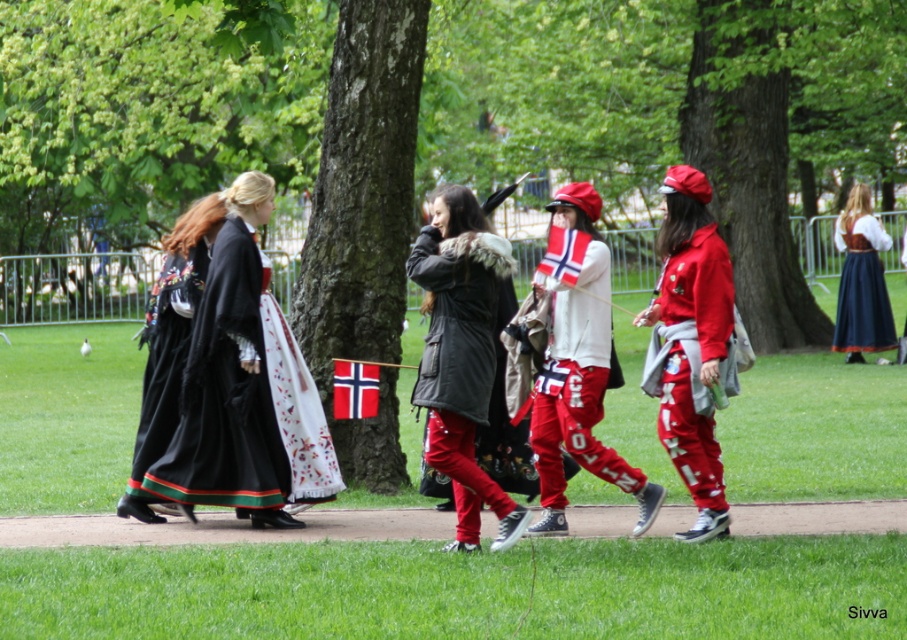
Is matte white hoodie at center wider than white fabric flag at center?

Indeed, matte white hoodie at center has a greater width compared to white fabric flag at center.

Is point (572, 445) less distant than point (551, 225)?

Yes, point (572, 445) is closer to viewer.

The width and height of the screenshot is (907, 640). In order to click on matte white hoodie at center in this screenshot , I will do `click(576, 381)`.

Can you confirm if velvet black dress at left is thinner than red fabric flag at center?

No.

Does velvet black dress at left come behind red fabric flag at center?

That is False.

The image size is (907, 640). What are the coordinates of `velvet black dress at left` in the screenshot? It's located at (169, 346).

What are the coordinates of `velvet black dress at left` in the screenshot? It's located at (169, 346).

At what (x,y) coordinates should I click in order to perform the action: click on matte red tracksuit at center. Please return your answer as a coordinate pair (x, y). Looking at the image, I should click on (698, 292).

Which is behind, point (675, 387) or point (357, 381)?

Positioned behind is point (357, 381).

Who is more distant from viewer, (715, 486) or (367, 404)?

The point (367, 404) is more distant.

Find the location of `matte red tracksuit at center`. matte red tracksuit at center is located at coordinates (698, 292).